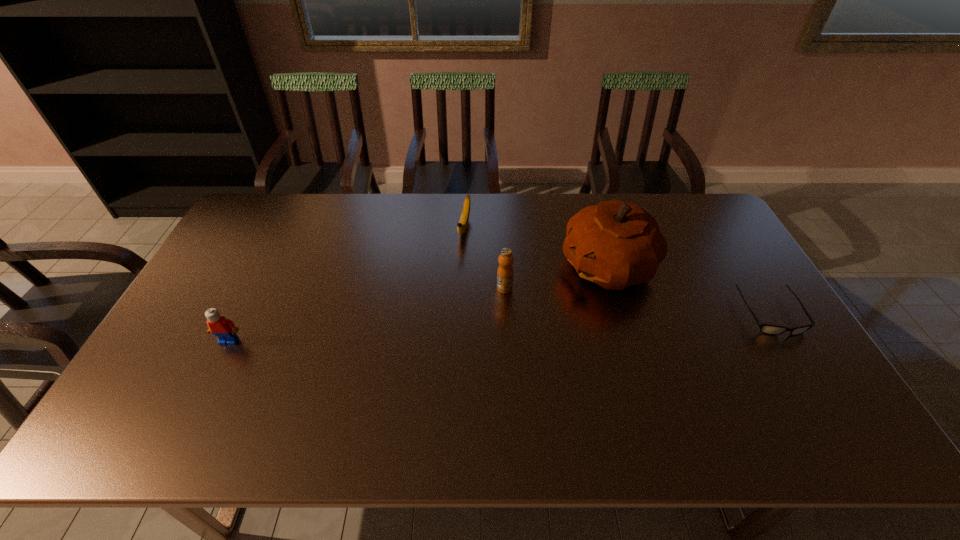
This screenshot has width=960, height=540. I want to click on vacant space on the desktop that is between the leftmost object and the shortest object and is positioned at the stem of the fourth tallest object, so click(x=438, y=330).

This screenshot has height=540, width=960. I want to click on vacant space on the desktop that is between the third shortest object and the sunglasses and is positioned on the front-facing side of the tallest object, so click(513, 327).

This screenshot has width=960, height=540. I want to click on vacant space on the desktop that is between the leftmost object and the sunglasses and is positioned on the front label of the fourth shortest object, so click(460, 329).